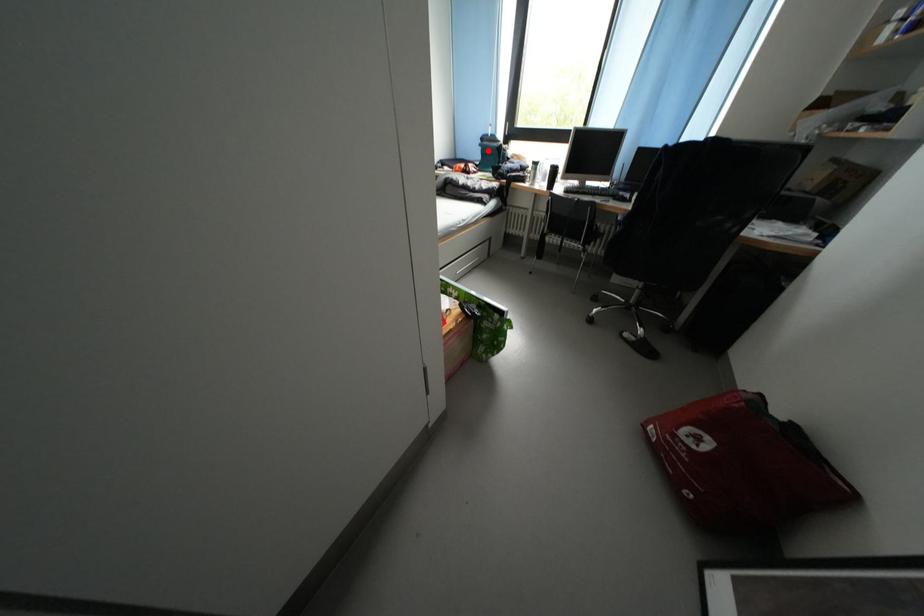
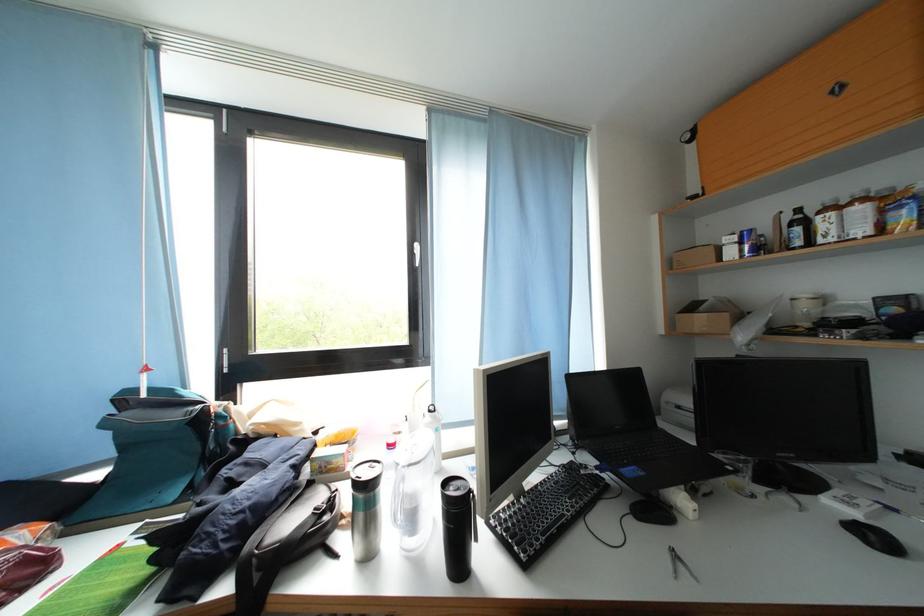
Question: I am providing you with two images of the same scene from different viewpoints. Given a red point in image1, look at the same physical point in image2. Is it:

Choices:
 (A) Closer to the viewpoint
 (B) Farther from the viewpoint

Answer: (B)